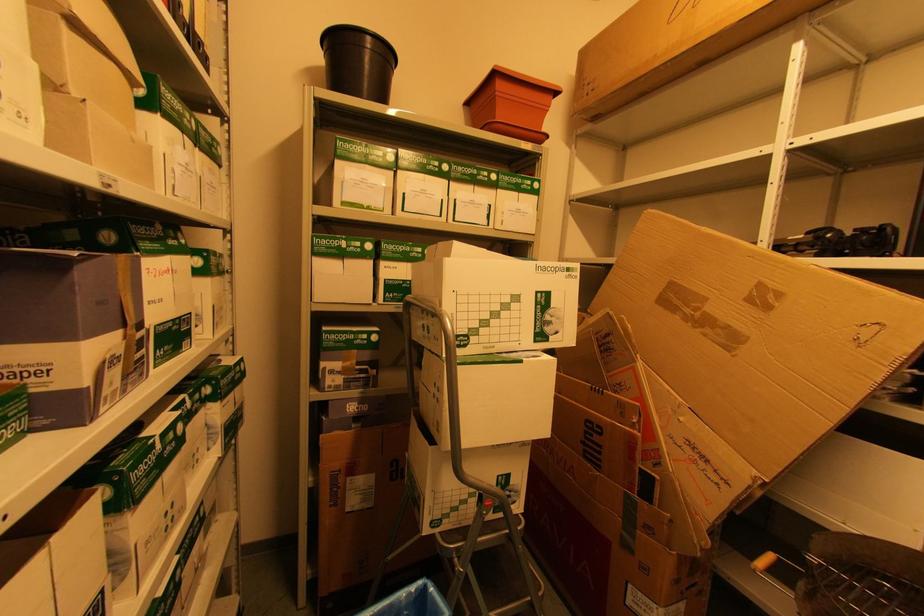
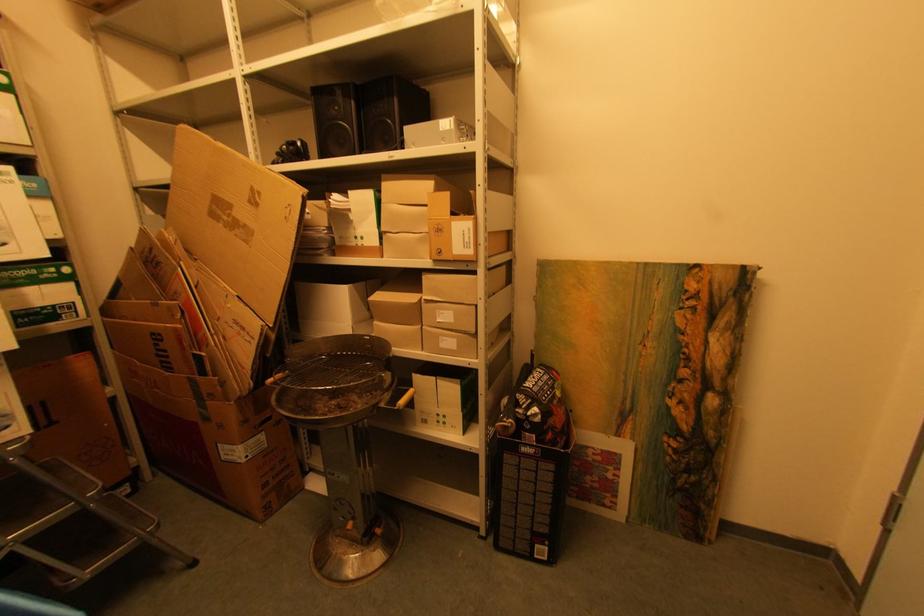
Question: Based on the continuous images, in which direction is the camera rotating? Reply with the corresponding letter.

Choices:
 (A) Left
 (B) Right
 (C) Up
 (D) Down

Answer: (B)